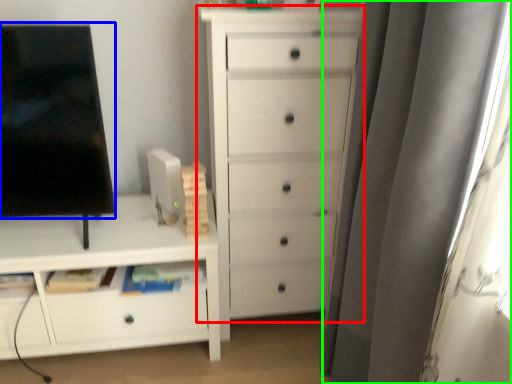
Question: Based on their relative distances, which object is farther from chest of drawers (highlighted by a red box)? Choose from screen (highlighted by a blue box) and curtain (highlighted by a green box).

Choices:
 (A) screen
 (B) curtain

Answer: (A)